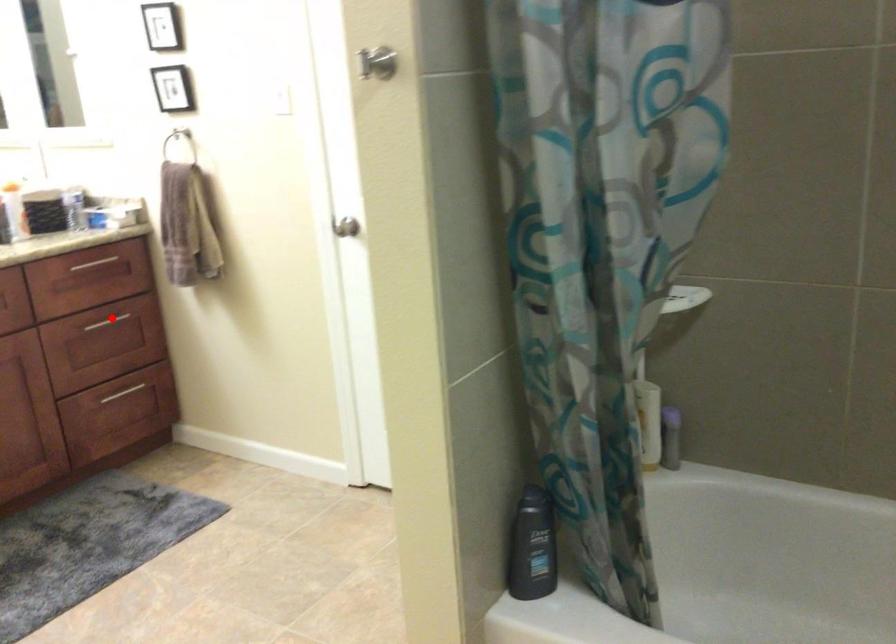
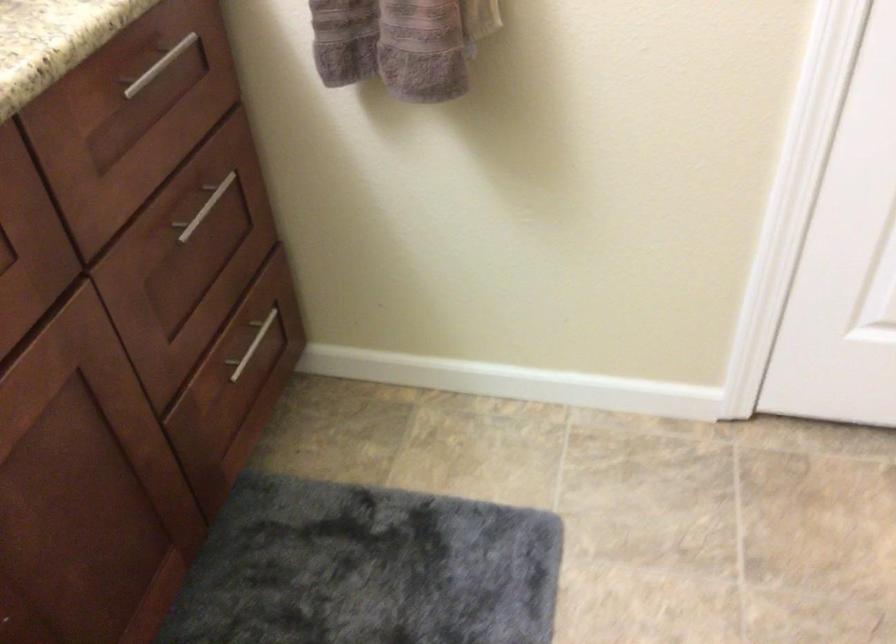
Question: I am providing you with two images of the same scene from different viewpoints. In image1, a red point is highlighted. Considering the same 3D point in image2, which of the following is correct?

Choices:
 (A) It is closer
 (B) It is farther

Answer: (A)